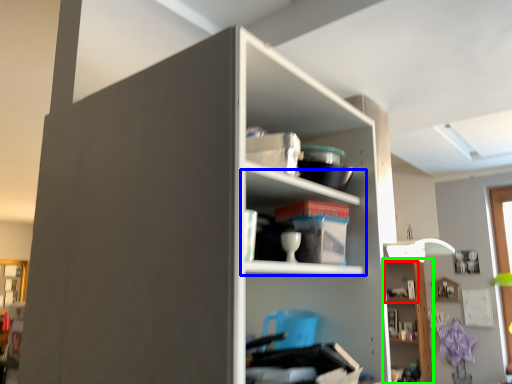
Question: Which is farther away from cabinet (highlighted by a red box)? shelf (highlighted by a blue box) or shelf (highlighted by a green box)?

Choices:
 (A) shelf
 (B) shelf

Answer: (A)